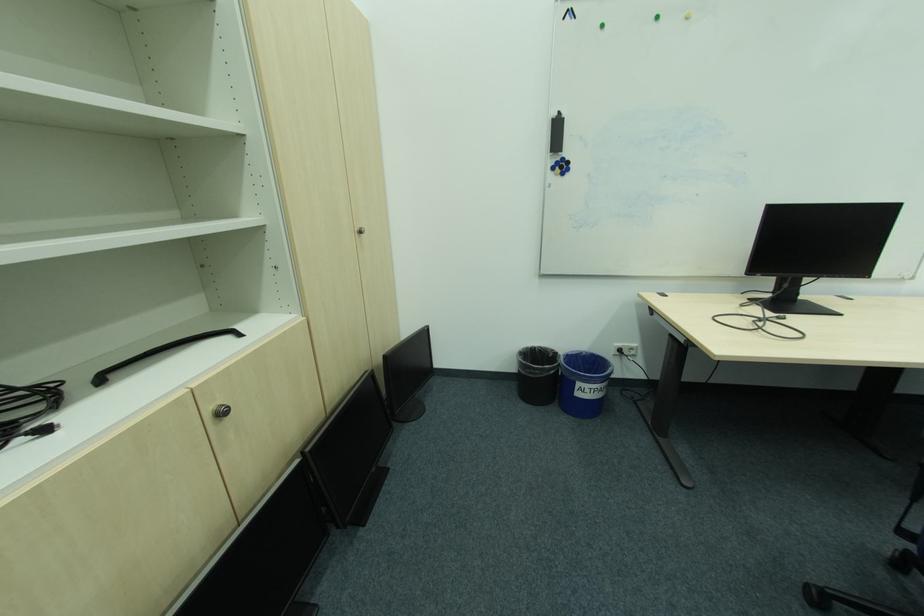
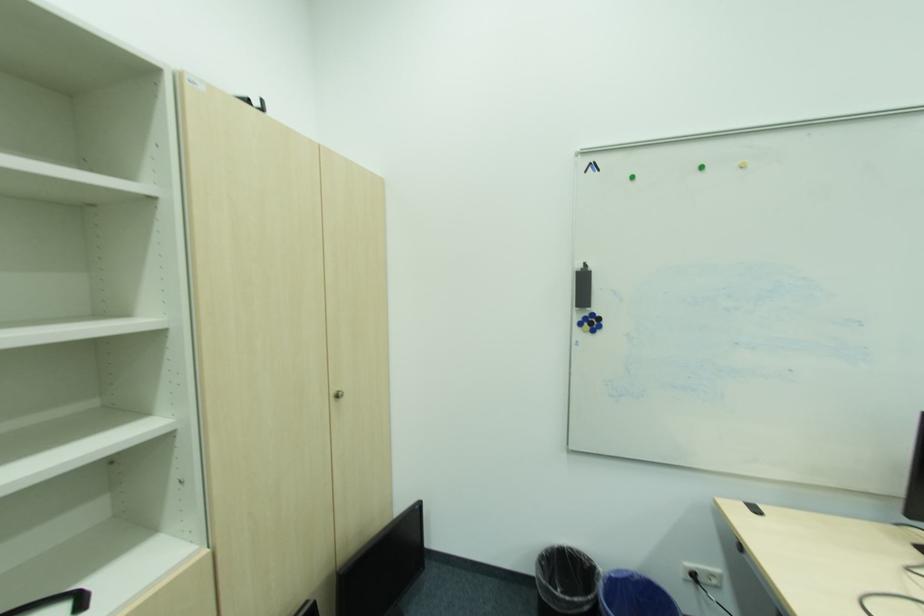
What movement of the cameraman would produce the second image?

The cameraman moved toward right, forward.